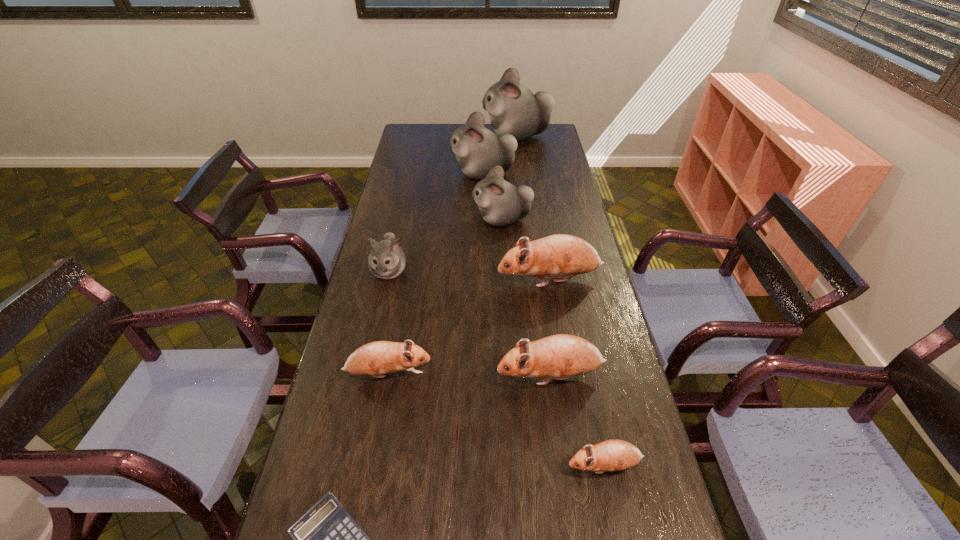
Locate an element on the screen. the farthest object is located at coordinates (513, 109).

The height and width of the screenshot is (540, 960). Identify the location of the biggest white hamster. (513, 109).

Locate an element on the screen. the eighth nearest object is located at coordinates (478, 149).

Identify the location of the third smallest white hamster. (478, 149).

Locate an element on the screen. The width and height of the screenshot is (960, 540). the second smallest white hamster is located at coordinates (500, 203).

This screenshot has width=960, height=540. Find the location of `the third farthest object`. the third farthest object is located at coordinates (500, 203).

This screenshot has width=960, height=540. I want to click on the biggest brown hamster, so click(557, 255).

Find the location of a particular element. The height and width of the screenshot is (540, 960). the leftmost white hamster is located at coordinates coord(387,260).

The image size is (960, 540). What are the coordinates of `the nearest white hamster` in the screenshot? It's located at (387, 260).

This screenshot has height=540, width=960. In order to click on the second biggest brown hamster in this screenshot , I will do `click(562, 356)`.